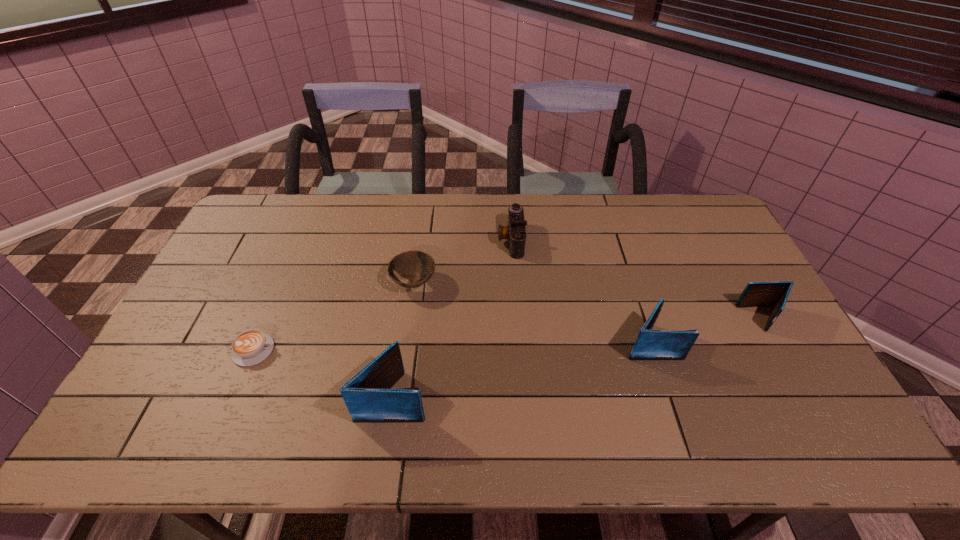
This screenshot has width=960, height=540. Identify the location of free location located on the side of the leftmost object with the handle. (404, 350).

At what (x,y) coordinates should I click in order to perform the action: click on free space located on the front of the bowl. Please return your answer as a coordinate pair (x, y). Looking at the image, I should click on (409, 319).

You are a GUI agent. You are given a task and a screenshot of the screen. Output one action in this format:
    pyautogui.click(x=<x>, y=<y>)
    Task: Click on the object positioned at the far edge
    Image resolution: width=960 pixels, height=540 pixels.
    Given the screenshot: What is the action you would take?
    pyautogui.click(x=515, y=232)

Find the location of `object that is at the near edge`. object that is at the near edge is located at coordinates (368, 396).

The image size is (960, 540). I want to click on object situated at the right edge, so click(x=774, y=294).

Locate an element on the screen. This screenshot has height=540, width=960. vacant space at the far edge of the desktop is located at coordinates (510, 202).

In the image, there is a desktop. Find the location of `vacant space at the near edge`. vacant space at the near edge is located at coordinates (569, 385).

Locate an element on the screen. This screenshot has width=960, height=540. vacant area at the left edge of the desktop is located at coordinates (201, 332).

This screenshot has width=960, height=540. Identify the location of free space at the right edge of the desktop. (707, 268).

Where is `free space at the far left corner of the desktop`? The height and width of the screenshot is (540, 960). free space at the far left corner of the desktop is located at coordinates (248, 234).